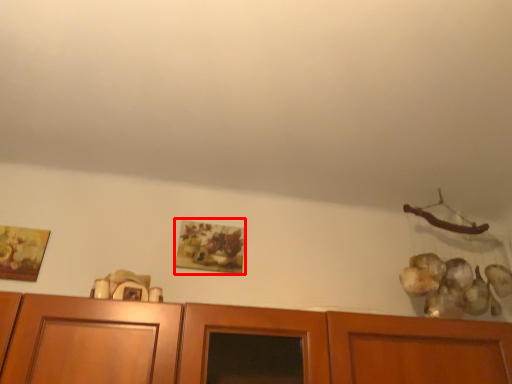
Question: From the image's perspective, where is picture frame (annotated by the red box) located relative to picture frame?

Choices:
 (A) below
 (B) above

Answer: (A)